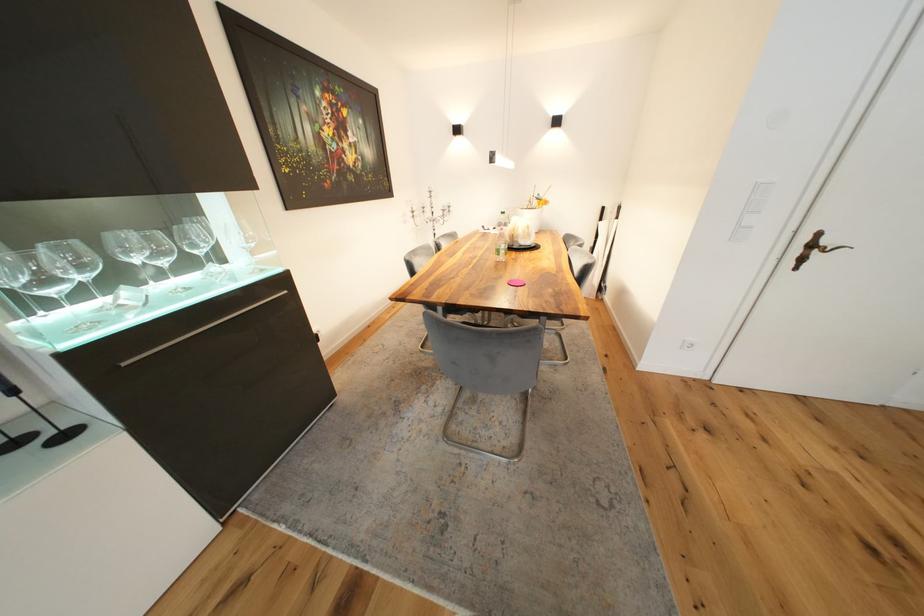
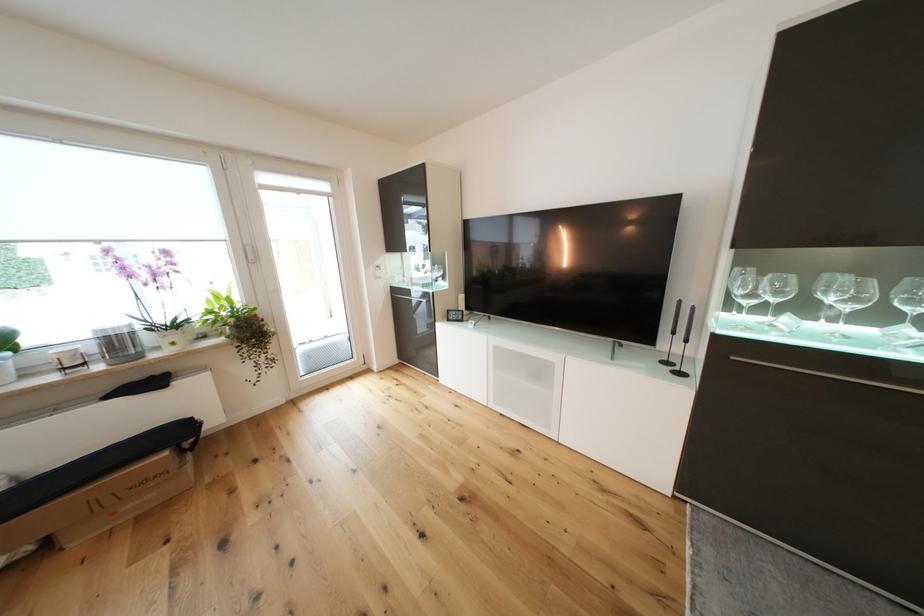
Locate, in the second image, the point that corresponds to the point at 57,283 in the first image.

(758, 297)